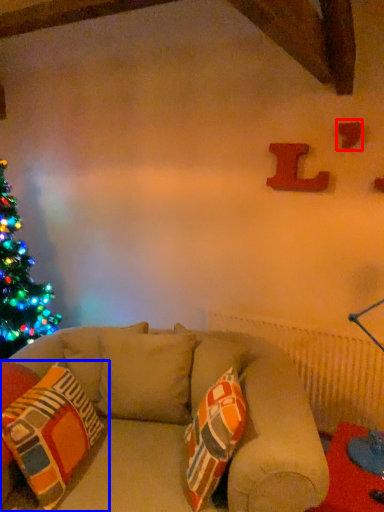
Question: Which of the following is the closest to the observer, alphabet (highlighted by a red box) or pillow (highlighted by a blue box)?

Choices:
 (A) alphabet
 (B) pillow

Answer: (B)